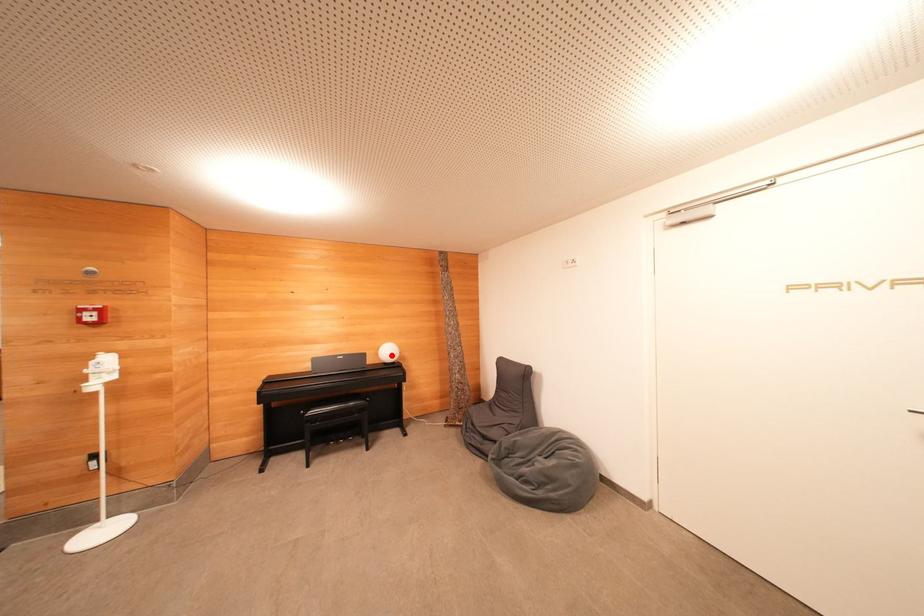
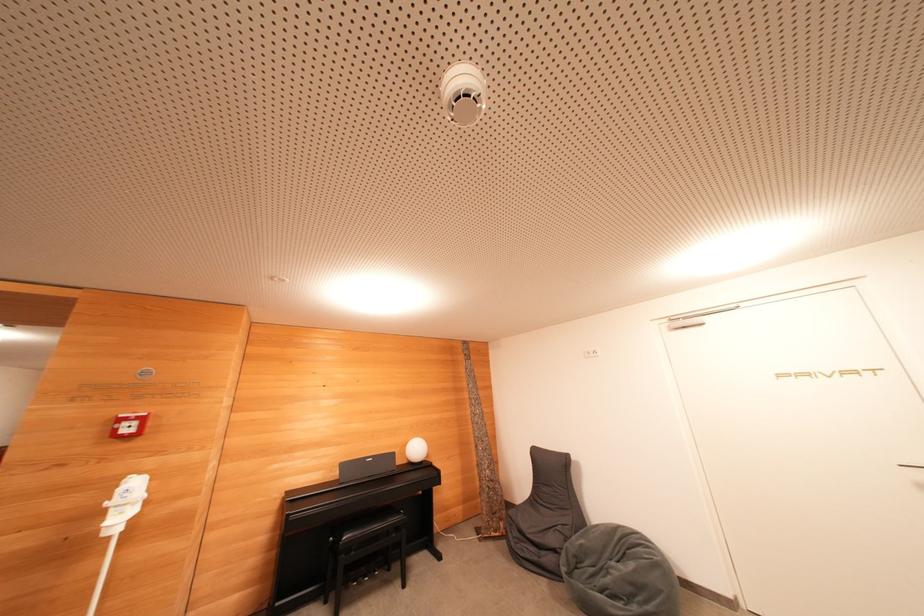
Question: A red point is marked in image1. In image2, is the corresponding 3D point closer to the camera or farther? Reply with the corresponding letter.

Choices:
 (A) The corresponding 3D point is closer.
 (B) The corresponding 3D point is farther.

Answer: (B)